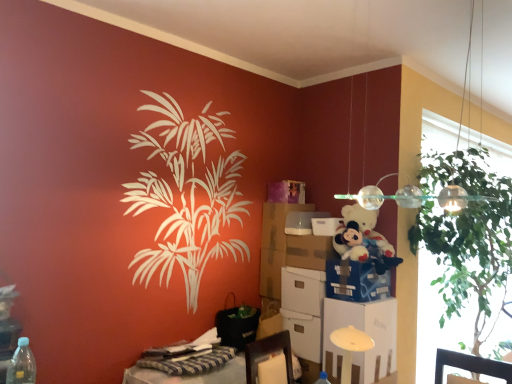
Question: Is matte cardboard box at center located outside white cardboard box at center, placed as the 6th box when sorted from bottom to top?

Choices:
 (A) no
 (B) yes

Answer: (B)

Question: Would you consider matte cardboard box at center to be distant from white cardboard box at center, placed as the 6th box when sorted from bottom to top?

Choices:
 (A) yes
 (B) no

Answer: (B)

Question: Is the surface of matte cardboard box at center in direct contact with white cardboard box at center, acting as the first box starting from the top?

Choices:
 (A) yes
 (B) no

Answer: (A)

Question: From the image's perspective, is matte cardboard box at center below white cardboard box at center, acting as the first box starting from the top?

Choices:
 (A) yes
 (B) no

Answer: (A)

Question: Does matte cardboard box at center turn towards white cardboard box at center, acting as the first box starting from the top?

Choices:
 (A) yes
 (B) no

Answer: (B)

Question: Is matte cardboard box at center looking in the opposite direction of white cardboard box at center, acting as the first box starting from the top?

Choices:
 (A) no
 (B) yes

Answer: (A)

Question: Does matte cardboard box at center have a smaller size compared to white plastic file cabinet at lower right?

Choices:
 (A) yes
 (B) no

Answer: (A)

Question: Is matte cardboard box at center not within white plastic file cabinet at lower right?

Choices:
 (A) yes
 (B) no

Answer: (A)

Question: Can you confirm if matte cardboard box at center is thinner than white plastic file cabinet at lower right?

Choices:
 (A) no
 (B) yes

Answer: (B)

Question: Does matte cardboard box at center lie behind white plastic file cabinet at lower right?

Choices:
 (A) yes
 (B) no

Answer: (A)

Question: Is matte cardboard box at center facing away from white plastic file cabinet at lower right?

Choices:
 (A) no
 (B) yes

Answer: (A)

Question: From a real-world perspective, is matte cardboard box at center positioned over white plastic file cabinet at lower right based on gravity?

Choices:
 (A) no
 (B) yes

Answer: (B)

Question: From a real-world perspective, does brown cardboard box at center-right, marked as the 3th box in a top-to-bottom arrangement, sit lower than blue cardboard box at center, which appears as the fourth box when viewed from the top?

Choices:
 (A) no
 (B) yes

Answer: (A)